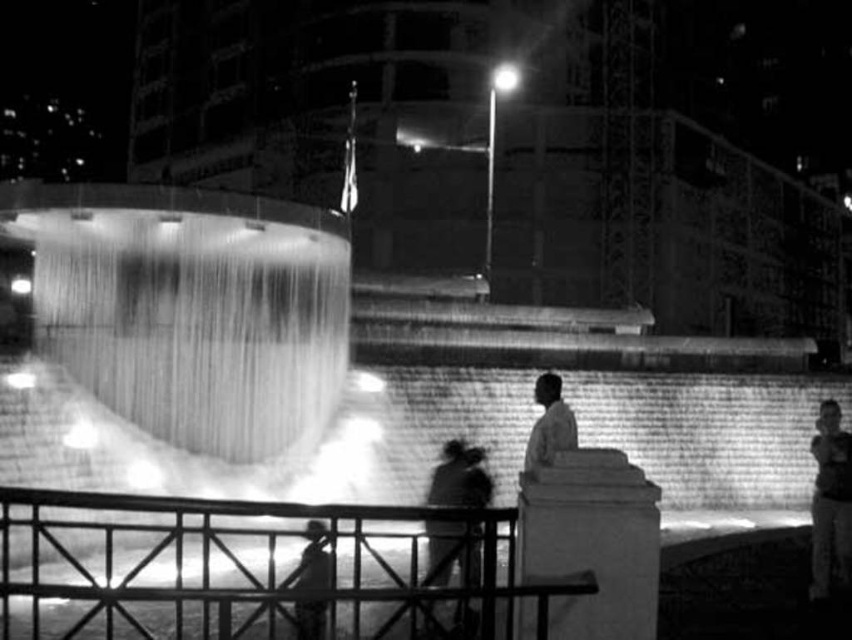
Question: Among these points, which one is farthest from the camera?

Choices:
 (A) (838, 522)
 (B) (306, 531)
 (C) (563, 420)
 (D) (58, 246)

Answer: (D)

Question: Which point is farther from the camera taking this photo?

Choices:
 (A) (527, 460)
 (B) (298, 572)

Answer: (A)

Question: Which is farther from the silhouette fabric at lower center?

Choices:
 (A) light brown leather jacket at center
 (B) translucent glass water at center
 (C) smooth skin face at right

Answer: (C)

Question: Does translucent glass water at center appear over light brown leather jacket at center?

Choices:
 (A) no
 (B) yes

Answer: (B)

Question: Observing the image, what is the correct spatial positioning of translucent glass water at center in reference to smooth skin face at right?

Choices:
 (A) right
 (B) left

Answer: (B)

Question: Can you confirm if smooth skin face at right is smaller than silhouette fabric at lower center?

Choices:
 (A) no
 (B) yes

Answer: (A)